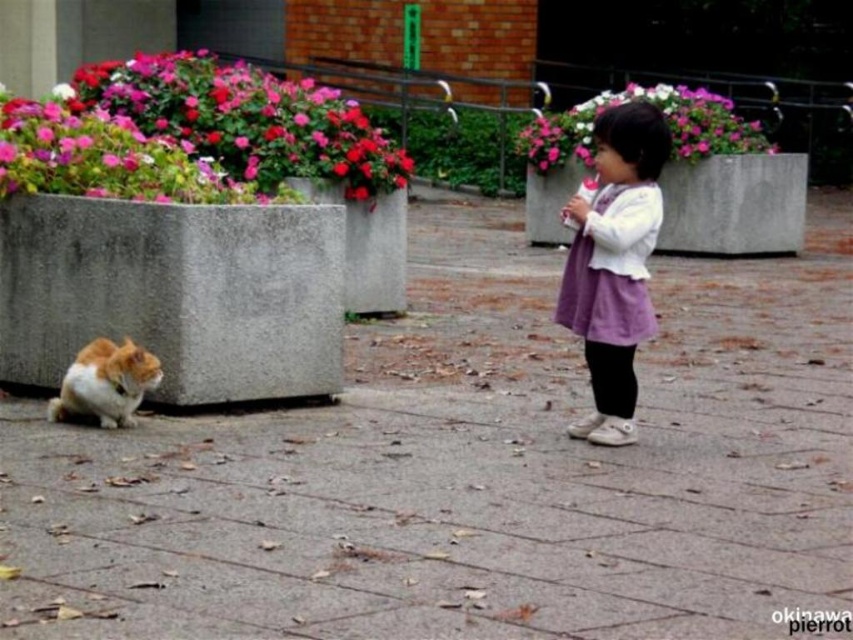
You are a photographer trying to capture a photo of the gray concrete pavement at center and the purple cotton dress at center. Which object is taller in the image?

The purple cotton dress at center is taller than the gray concrete pavement at center.

The child is standing in a courtyard with a cat. There is a point at coordinates (614, 264). What object is this point located on?

The point at coordinates (614, 264) is located on the purple cotton dress at center.